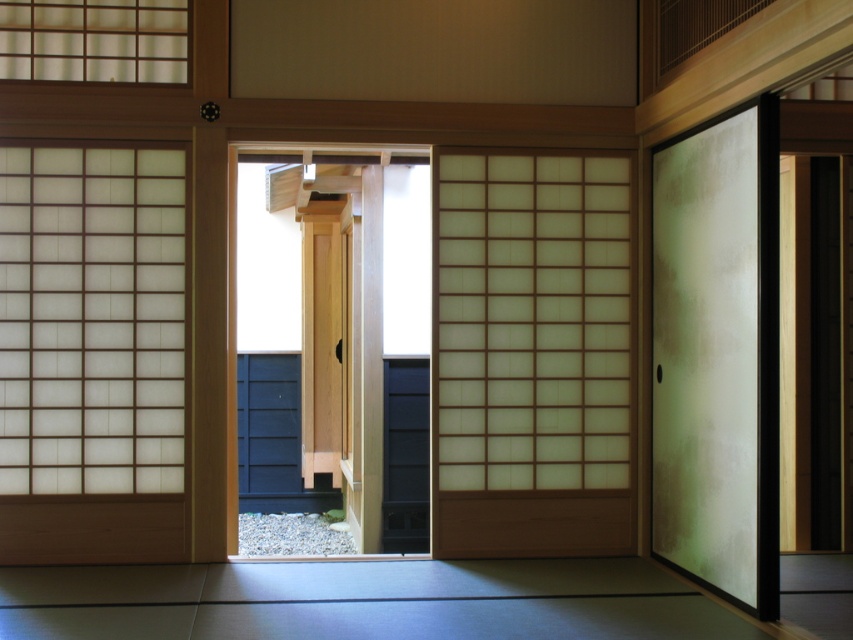
You are a guest in a traditional Japanese house and want to find the entrance to the garden. You see the frosted glass sliding door at right and the light wood door at center. Which door is located to the right of the other?

The frosted glass sliding door at right is positioned on the right side of the light wood door at center, so the frosted glass sliding door at right is to the right of the light wood door at center.

You are a guest in a traditional Japanese house and need to find the entrance to the garden. You see a satin white screen at center and a light wood door at center. Which object should you approach to reach the garden?

The light wood door at center is the entrance to the garden because the satin white screen at center is positioned to its right, indicating the door is located closer to the garden entrance.